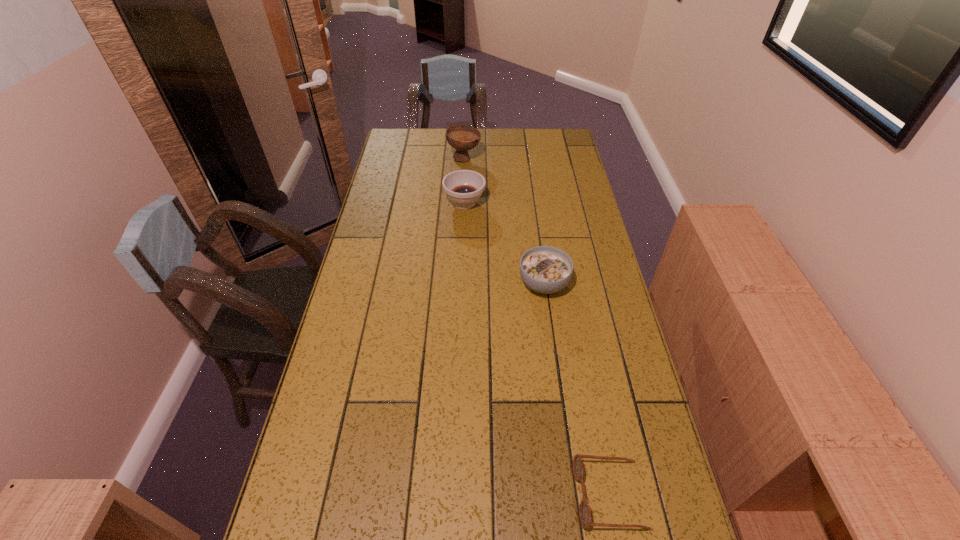
You are a GUI agent. You are given a task and a screenshot of the screen. Output one action in this format:
    pyautogui.click(x=<x>, y=<y>)
    Task: Click on the farthest object
    The width and height of the screenshot is (960, 540).
    Given the screenshot: What is the action you would take?
    pyautogui.click(x=461, y=137)

The image size is (960, 540). Identify the location of the tallest soup bowl. (461, 137).

Locate an element on the screen. Image resolution: width=960 pixels, height=540 pixels. the second nearest object is located at coordinates (544, 269).

Where is `the nearest soup bowl`? The height and width of the screenshot is (540, 960). the nearest soup bowl is located at coordinates (544, 269).

Locate an element on the screen. the second farthest object is located at coordinates pyautogui.click(x=463, y=187).

Image resolution: width=960 pixels, height=540 pixels. I want to click on the nearest object, so click(584, 508).

This screenshot has width=960, height=540. I want to click on the shortest object, so click(584, 508).

The height and width of the screenshot is (540, 960). What are the coordinates of `vacant space located on the right of the farthest object` in the screenshot? It's located at (509, 158).

Identify the location of free space located on the back of the second nearest object. (535, 219).

Where is `vacant space situated 0.180m on the front of the second farthest soup bowl`? vacant space situated 0.180m on the front of the second farthest soup bowl is located at coordinates tap(463, 248).